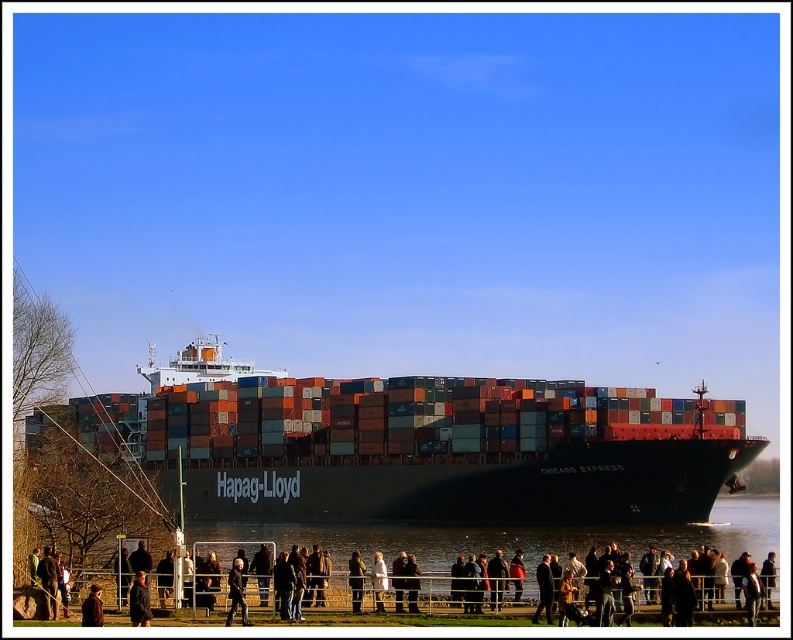
Question: Estimate the real-world distances between objects in this image. Which object is closer to the dark brown leather jacket at lower center?

Choices:
 (A) brown leather jacket at lower center
 (B) dark gray jacket at center

Answer: (B)

Question: Is dark brown leather jacket at lower center positioned at the back of light brown leather jacket at center?

Choices:
 (A) no
 (B) yes

Answer: (A)

Question: Is light brown leather jacket at center positioned behind brown leather jacket at lower center?

Choices:
 (A) no
 (B) yes

Answer: (B)

Question: Which object appears farthest from the camera in this image?

Choices:
 (A) dark brown leather jacket at lower center
 (B) transparent water at lower center
 (C) dark brown leather jacket at center
 (D) dark gray jacket at center

Answer: (B)

Question: Among these points, which one is nearest to the camera?

Choices:
 (A) (146, 621)
 (B) (240, 568)
 (C) (357, 602)
 (D) (295, 566)

Answer: (A)

Question: Where is dark brown leather jacket at lower center located in relation to light brown leather jacket at center in the image?

Choices:
 (A) above
 (B) below

Answer: (A)